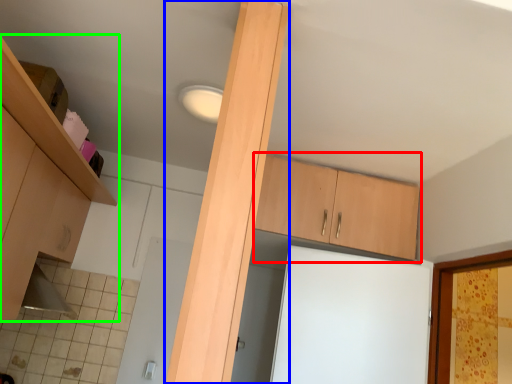
Question: Which object is positioned closest to cabinetry (highlighted by a red box)? Select from beam (highlighted by a blue box) and cabinetry (highlighted by a green box).

Choices:
 (A) beam
 (B) cabinetry

Answer: (B)